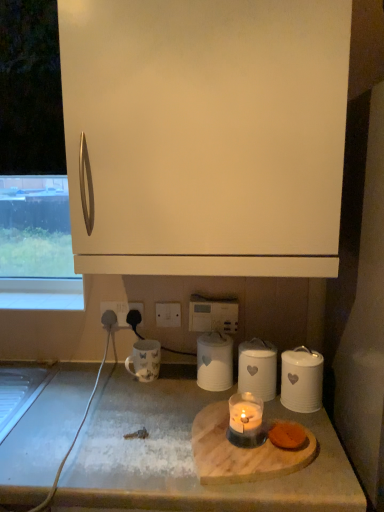
Locate an element on the screen. Image resolution: width=384 pixels, height=512 pixels. free space above wooden cutting board at lower center (from a real-world perspective) is located at coordinates (182, 418).